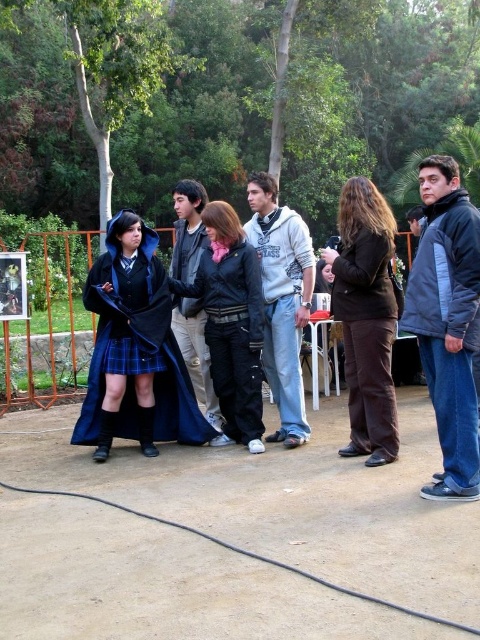
Is light gray hoodie at center above blue plaid kilt at center?

Yes.

Between light gray hoodie at center and blue plaid kilt at center, which one is positioned higher?

light gray hoodie at center is higher up.

Is point (277, 221) positioned before point (115, 342)?

That is False.

At what (x,y) coordinates should I click in order to perform the action: click on light gray hoodie at center. Please return your answer as a coordinate pair (x, y). Looking at the image, I should click on (282, 300).

Who is lower down, matte blue coat at center or leather jacket at center?

Positioned lower is matte blue coat at center.

Does point (166, 433) come closer to viewer compared to point (235, 372)?

No, (166, 433) is behind (235, 372).

Measure the distance between matte blue coat at center and camera.

4.74 meters

Find the location of a particular element. The width and height of the screenshot is (480, 640). matte blue coat at center is located at coordinates (134, 349).

Who is more forward, (347, 273) or (208, 314)?

Positioned in front is point (347, 273).

Does brown leather jacket at center have a lesser height compared to leather jacket at center?

Yes, brown leather jacket at center is shorter than leather jacket at center.

Locate an element on the screen. Image resolution: width=480 pixels, height=640 pixels. brown leather jacket at center is located at coordinates (365, 317).

Find the location of a particular element. Image resolution: width=480 pixels, height=640 pixels. brown leather jacket at center is located at coordinates (365, 317).